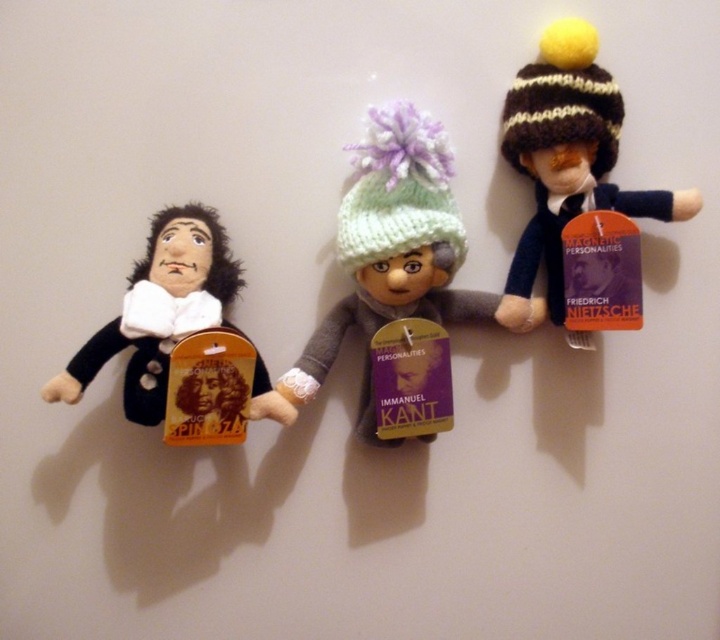
Can you confirm if knitted green hat at center is smaller than velvet black doll at left?

Actually, knitted green hat at center might be larger than velvet black doll at left.

Is knitted green hat at center to the left of velvet black doll at left from the viewer's perspective?

In fact, knitted green hat at center is to the right of velvet black doll at left.

Does point (292, 410) come behind point (224, 236)?

That is False.

Image resolution: width=720 pixels, height=640 pixels. What are the coordinates of `knitted green hat at center` in the screenshot? It's located at (395, 250).

Consider the image. Who is taller, knitted green hat at center or knitted woolen hat at upper right?

With more height is knitted green hat at center.

Does point (436, 172) lie in front of point (566, 147)?

Yes.

The width and height of the screenshot is (720, 640). Describe the element at coordinates (395, 250) in the screenshot. I see `knitted green hat at center` at that location.

At what (x,y) coordinates should I click in order to perform the action: click on knitted green hat at center. Please return your answer as a coordinate pair (x, y). This screenshot has height=640, width=720. Looking at the image, I should click on (395, 250).

Is the position of knitted woolen hat at upper right less distant than that of velvet black doll at left?

No, knitted woolen hat at upper right is behind velvet black doll at left.

Is knitted woolen hat at upper right shorter than velvet black doll at left?

Incorrect, knitted woolen hat at upper right's height does not fall short of velvet black doll at left's.

This screenshot has width=720, height=640. What do you see at coordinates (567, 156) in the screenshot? I see `knitted woolen hat at upper right` at bounding box center [567, 156].

This screenshot has height=640, width=720. What are the coordinates of `knitted woolen hat at upper right` in the screenshot? It's located at (567, 156).